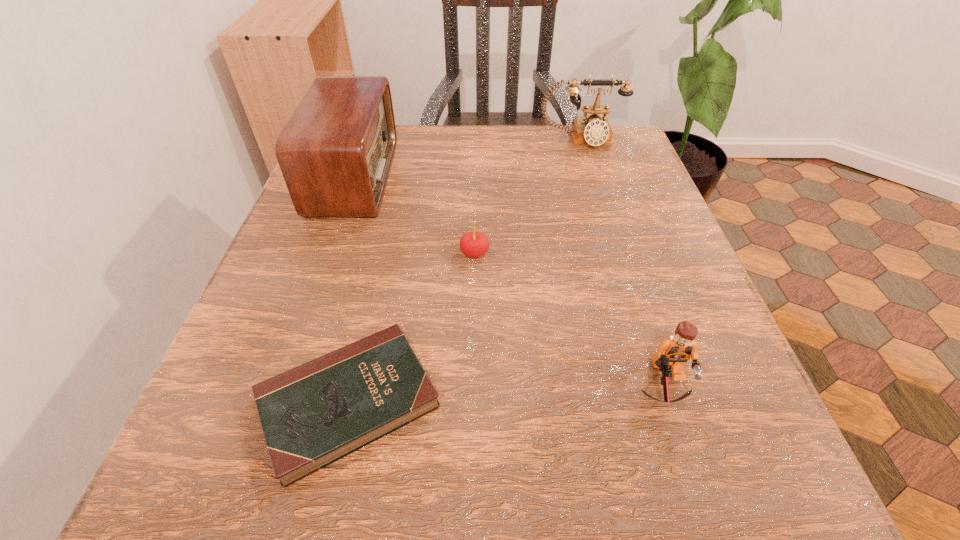
Image resolution: width=960 pixels, height=540 pixels. In order to click on object present at the far right corner in this screenshot , I will do `click(594, 130)`.

At what (x,y) coordinates should I click in order to perform the action: click on free location at the far edge. Please return your answer as a coordinate pair (x, y). Image resolution: width=960 pixels, height=540 pixels. Looking at the image, I should click on (497, 139).

Where is `free space at the left edge of the desktop`? free space at the left edge of the desktop is located at coordinates (253, 367).

At what (x,y) coordinates should I click in order to perform the action: click on vacant space at the far right corner of the desktop. Please return your answer as a coordinate pair (x, y). The width and height of the screenshot is (960, 540). Looking at the image, I should click on (572, 174).

This screenshot has height=540, width=960. Find the location of `vacant space at the near right corner of the desktop`. vacant space at the near right corner of the desktop is located at coordinates (645, 454).

Image resolution: width=960 pixels, height=540 pixels. In order to click on vacant space that's between the third nearest object and the Lego in this screenshot , I will do `click(569, 319)`.

Locate an element on the screen. Image resolution: width=960 pixels, height=540 pixels. vacant area that lies between the shortest object and the cherry is located at coordinates (412, 328).

Image resolution: width=960 pixels, height=540 pixels. Find the location of `free space between the telephone and the radio receiver`. free space between the telephone and the radio receiver is located at coordinates (468, 158).

Identify the location of unoccupied area between the Lego and the Bible. (507, 394).

You are a GUI agent. You are given a task and a screenshot of the screen. Output one action in this format:
    pyautogui.click(x=<x>, y=<y>)
    Task: Click on the vacant space that's between the shortest object and the radio receiver
    
    Given the screenshot: What is the action you would take?
    pyautogui.click(x=351, y=289)